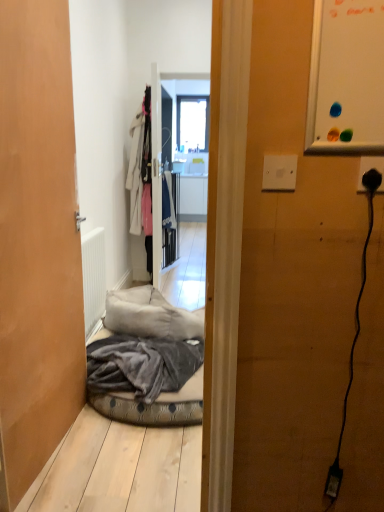
Question: Is point coord(64,318) positioned closer to the camera than point coord(182,140)?

Choices:
 (A) closer
 (B) farther

Answer: (A)

Question: In terms of height, does wooden door at left look taller or shorter compared to transparent glass window at center?

Choices:
 (A) tall
 (B) short

Answer: (A)

Question: Which is farther from the black plastic plug at right?

Choices:
 (A) white fabric coat at center
 (B) white matte radiator at left
 (C) wooden door at left
 (D) transparent glass window at center

Answer: (D)

Question: Which object is positioned closest to the black plastic plug at right?

Choices:
 (A) transparent glass window at center
 (B) white fabric coat at center
 (C) white matte radiator at left
 (D) wooden door at left

Answer: (D)